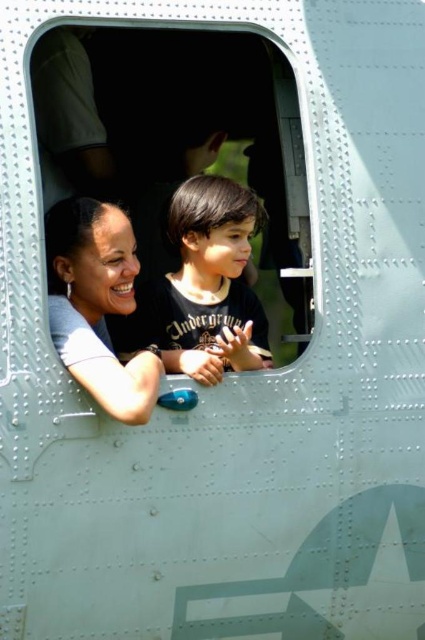
You are a photographer trying to capture a closeup shot of the dark brown hair at center and the smooth skin nose at center through the aircraft window. Since the window is slightly curved, you need to know which object is taller to adjust your lens properly. Which one is taller?

The dark brown hair at center is taller than the smooth skin nose at center, so you should adjust your lens to focus on the taller object first.